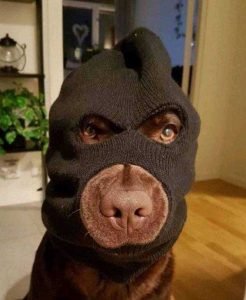
What are the coordinates of `floor` in the screenshot? It's located at (194, 212).